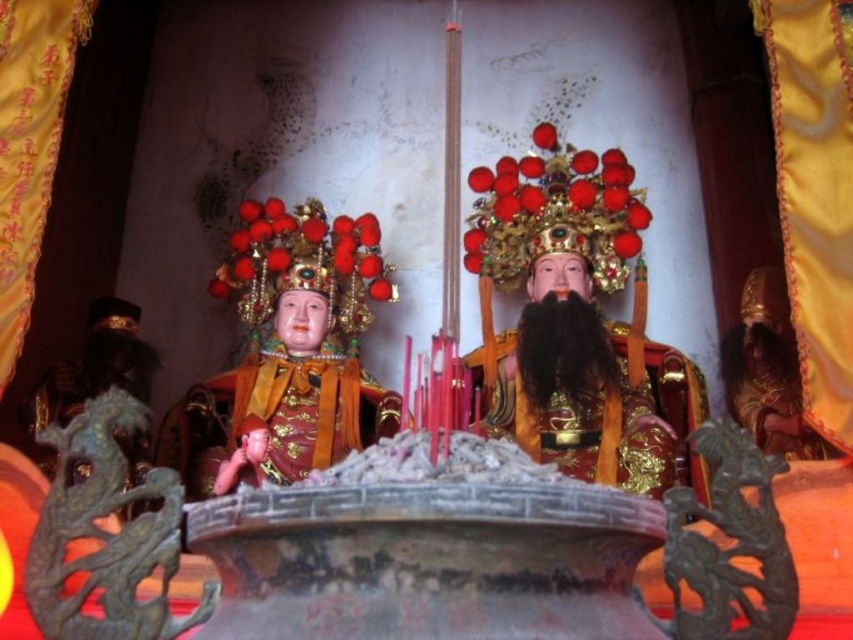
Question: Does gold textured statue at right have a larger size compared to smooth skin baby at lower left?

Choices:
 (A) no
 (B) yes

Answer: (B)

Question: Estimate the real-world distances between objects in this image. Which object is closer to the smooth skin baby at lower left?

Choices:
 (A) glossy gold statue at center
 (B) gold textured statue at right

Answer: (A)

Question: Which point is farther from the camera taking this photo?

Choices:
 (A) (511, 280)
 (B) (247, 451)

Answer: (A)

Question: Is matte gold statue at center wider than smooth skin baby at lower left?

Choices:
 (A) yes
 (B) no

Answer: (A)

Question: Does glossy gold statue at center have a smaller size compared to smooth skin baby at lower left?

Choices:
 (A) no
 (B) yes

Answer: (A)

Question: Among these points, which one is farthest from the camera?

Choices:
 (A) (225, 465)
 (B) (326, 257)

Answer: (B)